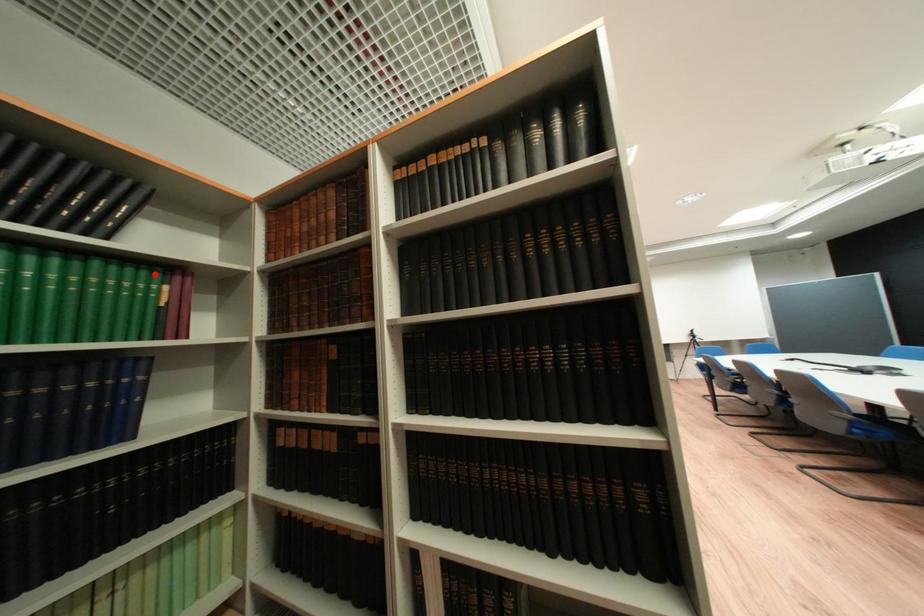
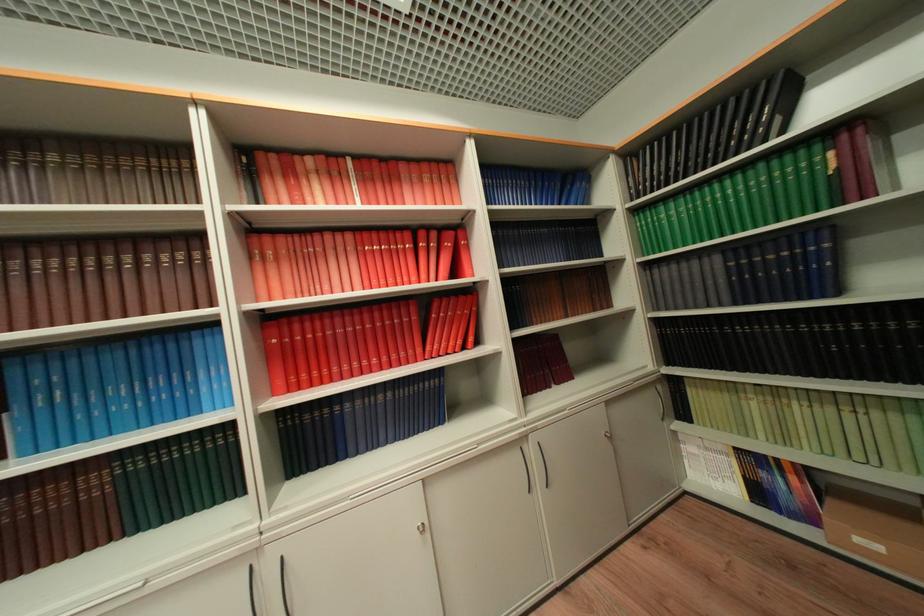
Where in the second image is the point corresponding to the highlighted location from the first image?

(813, 153)